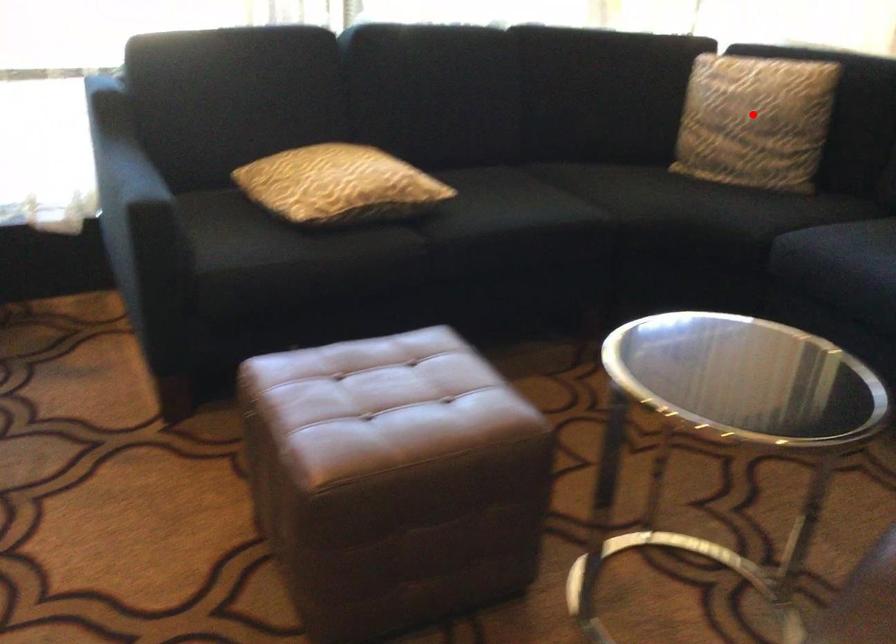
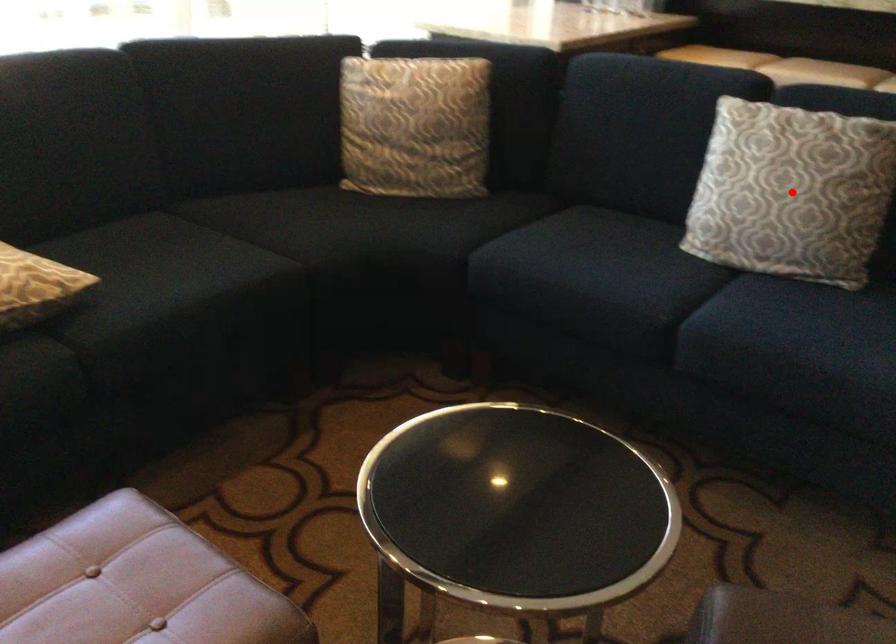
I am providing you with two images of the same scene from different viewpoints. A red point is marked on the first image and another point is marked on the second image. Are the points marked in image1 and image2 representing the same 3D position?

No